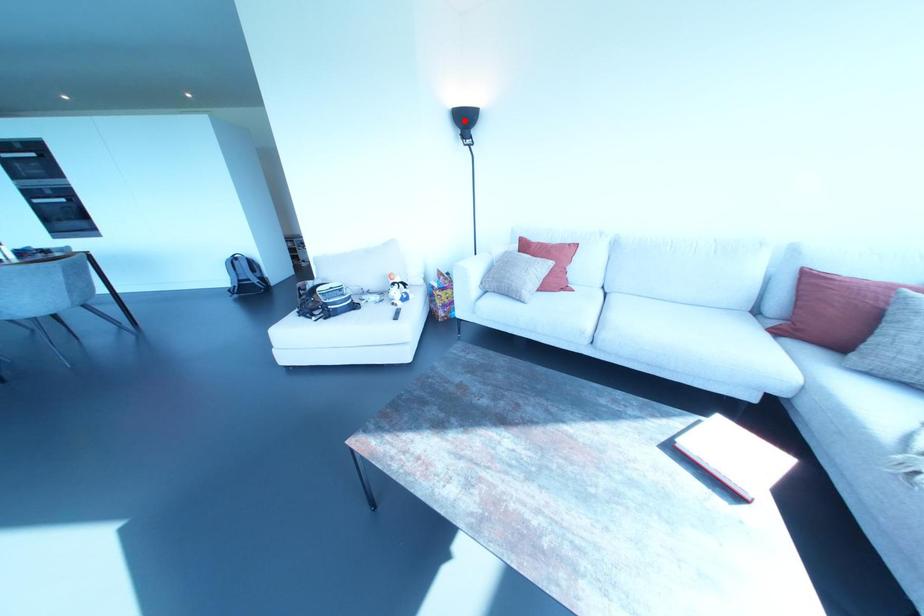
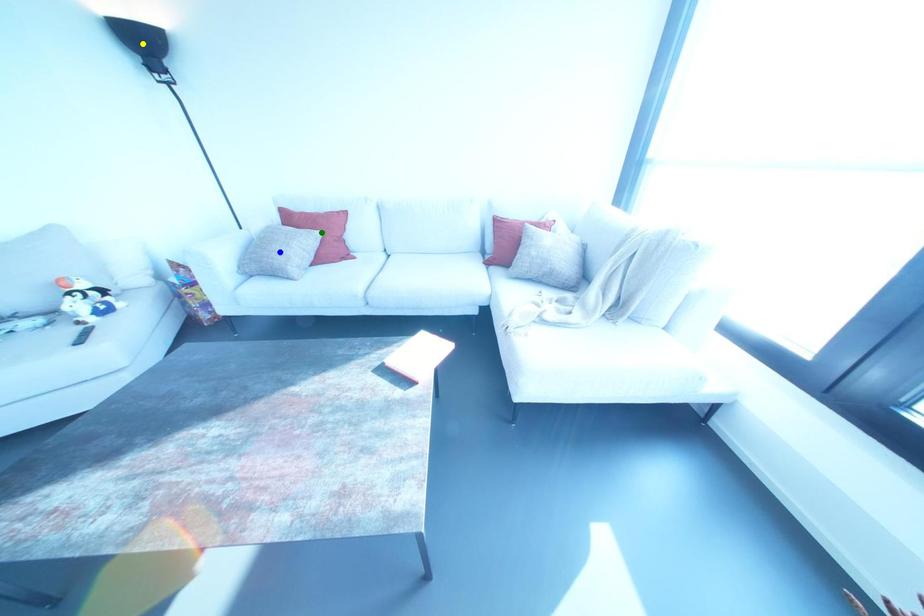
Question: I am providing you with two images of the same scene from different viewpoints. A red point is marked on the first image. You are given multiple points on the second image. Which point in image 2 represents the same 3d spot as the red point in image 1?

Choices:
 (A) yellow point
 (B) blue point
 (C) green point

Answer: (A)